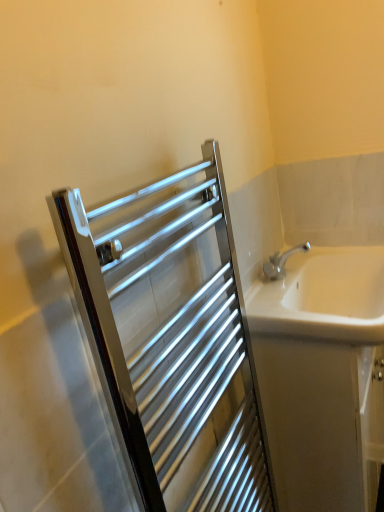
Question: From a real-world perspective, is white glossy bathtub at right positioned under white ceramic sink at right based on gravity?

Choices:
 (A) no
 (B) yes

Answer: (B)

Question: Could white ceramic sink at right be considered to be inside white glossy bathtub at right?

Choices:
 (A) yes
 (B) no

Answer: (B)

Question: Is white glossy bathtub at right bigger than white ceramic sink at right?

Choices:
 (A) yes
 (B) no

Answer: (A)

Question: From a real-world perspective, is white glossy bathtub at right on white ceramic sink at right?

Choices:
 (A) no
 (B) yes

Answer: (A)

Question: Considering the relative sizes of white glossy bathtub at right and white ceramic sink at right in the image provided, is white glossy bathtub at right smaller than white ceramic sink at right?

Choices:
 (A) yes
 (B) no

Answer: (B)

Question: Is white ceramic sink at right bigger or smaller than white glossy bathtub at right?

Choices:
 (A) small
 (B) big

Answer: (A)

Question: Do you think white ceramic sink at right is within white glossy bathtub at right, or outside of it?

Choices:
 (A) inside
 (B) outside

Answer: (B)

Question: From a real-world perspective, is white ceramic sink at right positioned above or below white glossy bathtub at right?

Choices:
 (A) above
 (B) below

Answer: (A)

Question: Is point (347, 294) closer or farther from the camera than point (301, 409)?

Choices:
 (A) closer
 (B) farther

Answer: (B)

Question: Is point (119, 276) closer or farther from the camera than point (382, 425)?

Choices:
 (A) closer
 (B) farther

Answer: (A)

Question: Considering the positions of polished chrome towel rack at upper left and white glossy bathtub at right in the image, is polished chrome towel rack at upper left bigger or smaller than white glossy bathtub at right?

Choices:
 (A) big
 (B) small

Answer: (B)

Question: Considering the positions of polished chrome towel rack at upper left and white glossy bathtub at right in the image, is polished chrome towel rack at upper left taller or shorter than white glossy bathtub at right?

Choices:
 (A) short
 (B) tall

Answer: (B)

Question: From the image's perspective, is polished chrome towel rack at upper left located above or below white glossy bathtub at right?

Choices:
 (A) above
 (B) below

Answer: (A)

Question: Is point (193, 274) closer or farther from the camera than point (375, 280)?

Choices:
 (A) closer
 (B) farther

Answer: (A)

Question: Based on their positions, is polished chrome towel rack at upper left located to the left or right of white ceramic sink at right?

Choices:
 (A) right
 (B) left

Answer: (B)